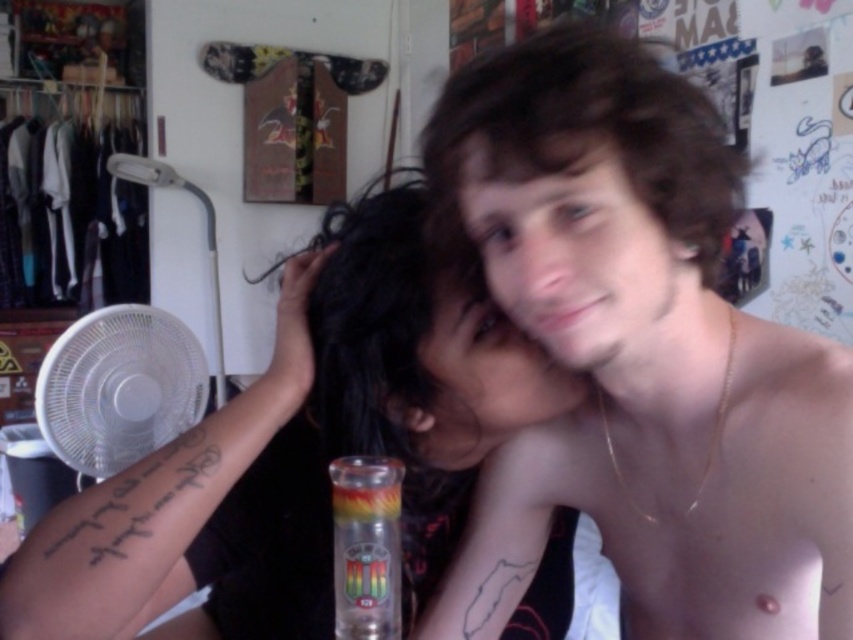
You are trying to determine the order of the two people from left to right based on their hair colors. Which person has their hair color described as black hair at center located below the dark curly hair at center?

The black hair at center is positioned under dark curly hair at center, so the person with black hair at center is behind the person with dark curly hair at center.

You are a photographer trying to capture a portrait of both individuals in the image. The camera you are using has a focus range of 20 inches. Can you focus on both the black hair at center and the gold chain necklace simultaneously?

The black hair at center and the gold chain necklace are 21.52 inches apart. Since the camera has a focus range of 20 inches, it cannot focus on both simultaneously because the distance between them exceeds the focus range.

Consider the image. You are an interior designer assessing the placement of the white plastic fan at left in a room. You notice the black tattooed arm at left is currently blocking the fan. Would adjusting the fan position to avoid the arm improve airflow in the room?

The black tattooed arm at left is in front of the white plastic fan at left, so moving the fan away from the arm would likely improve airflow by removing the obstruction.